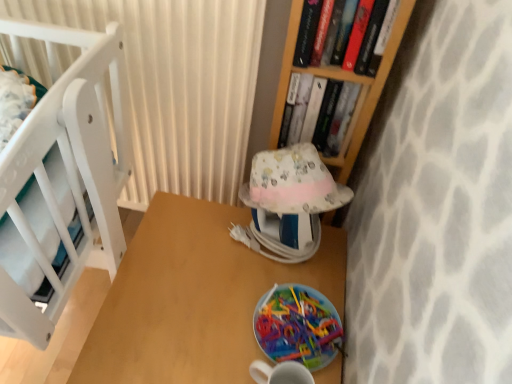
Identify the location of vacant space to the left of translucent plastic plate at lower center. (211, 305).